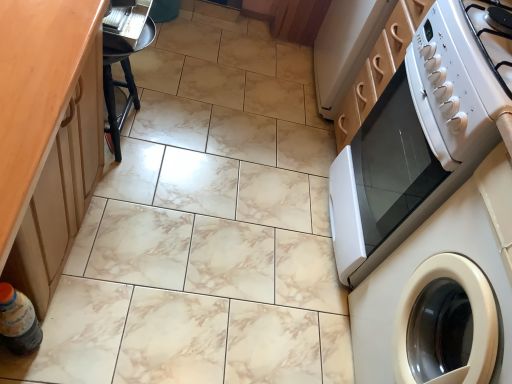
Question: Considering the relative sizes of white glossy microwave at right and black wood bar stool at left in the image provided, is white glossy microwave at right smaller than black wood bar stool at left?

Choices:
 (A) yes
 (B) no

Answer: (B)

Question: Is white glossy microwave at right oriented towards black wood bar stool at left?

Choices:
 (A) yes
 (B) no

Answer: (A)

Question: Does white glossy microwave at right come in front of black wood bar stool at left?

Choices:
 (A) yes
 (B) no

Answer: (A)

Question: Is black wood bar stool at left inside white glossy microwave at right?

Choices:
 (A) yes
 (B) no

Answer: (B)

Question: Is white glossy microwave at right bigger than black wood bar stool at left?

Choices:
 (A) no
 (B) yes

Answer: (B)

Question: From a real-world perspective, is dark brown plastic bottle at lower left positioned above or below white glossy microwave at right?

Choices:
 (A) above
 (B) below

Answer: (B)

Question: Considering the positions of point (31, 334) and point (394, 243), is point (31, 334) closer or farther from the camera than point (394, 243)?

Choices:
 (A) closer
 (B) farther

Answer: (A)

Question: Is dark brown plastic bottle at lower left in front of or behind white glossy microwave at right in the image?

Choices:
 (A) front
 (B) behind

Answer: (A)

Question: Considering the positions of dark brown plastic bottle at lower left and white glossy microwave at right in the image, is dark brown plastic bottle at lower left bigger or smaller than white glossy microwave at right?

Choices:
 (A) big
 (B) small

Answer: (B)

Question: From a real-world perspective, is black wood bar stool at left positioned above or below white glossy washing machine at right?

Choices:
 (A) below
 (B) above

Answer: (A)

Question: Considering the positions of black wood bar stool at left and white glossy washing machine at right in the image, is black wood bar stool at left taller or shorter than white glossy washing machine at right?

Choices:
 (A) tall
 (B) short

Answer: (B)

Question: Considering their positions, is black wood bar stool at left located in front of or behind white glossy washing machine at right?

Choices:
 (A) front
 (B) behind

Answer: (B)

Question: From the image's perspective, relative to white glossy washing machine at right, is black wood bar stool at left above or below?

Choices:
 (A) below
 (B) above

Answer: (B)

Question: Based on their sizes in the image, would you say white glossy microwave at right is bigger or smaller than white glossy electric stove at upper right?

Choices:
 (A) big
 (B) small

Answer: (A)

Question: Choose the correct answer: Is white glossy microwave at right inside white glossy electric stove at upper right or outside it?

Choices:
 (A) inside
 (B) outside

Answer: (B)